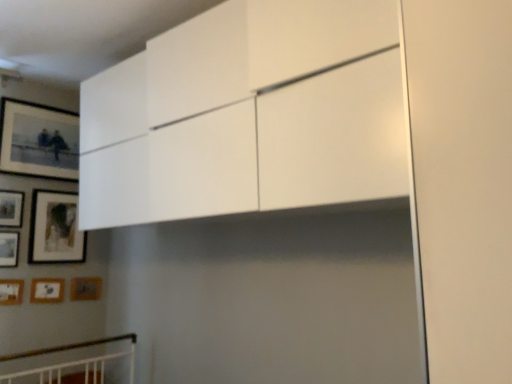
Question: Would you say matte black picture frame at upper left, positioned as the 7th picture frame in bottom-to-top order, contains wooden matte picture frame at lower left, placed as the 7th picture frame when sorted from top to bottom?

Choices:
 (A) no
 (B) yes

Answer: (A)

Question: Considering the relative positions of matte black picture frame at upper left, positioned as the 1th picture frame in top-to-bottom order, and wooden matte picture frame at lower left, placed as the 7th picture frame when sorted from top to bottom, in the image provided, is matte black picture frame at upper left, positioned as the 1th picture frame in top-to-bottom order, behind wooden matte picture frame at lower left, placed as the 7th picture frame when sorted from top to bottom,?

Choices:
 (A) yes
 (B) no

Answer: (B)

Question: From the image's perspective, would you say matte black picture frame at upper left, positioned as the 7th picture frame in bottom-to-top order, is positioned over wooden matte picture frame at lower left, marked as the 1th picture frame in a bottom-to-top arrangement?

Choices:
 (A) yes
 (B) no

Answer: (A)

Question: Does matte black picture frame at upper left, positioned as the 1th picture frame in top-to-bottom order, have a greater width compared to wooden matte picture frame at lower left, placed as the 7th picture frame when sorted from top to bottom?

Choices:
 (A) no
 (B) yes

Answer: (B)

Question: Would you consider matte black picture frame at upper left, positioned as the 1th picture frame in top-to-bottom order, to be distant from wooden matte picture frame at lower left, placed as the 7th picture frame when sorted from top to bottom?

Choices:
 (A) no
 (B) yes

Answer: (A)

Question: Considering the positions of point (15, 119) and point (64, 206), is point (15, 119) closer or farther from the camera than point (64, 206)?

Choices:
 (A) closer
 (B) farther

Answer: (A)

Question: Looking at the image, does matte black picture frame at upper left, positioned as the 7th picture frame in bottom-to-top order, seem bigger or smaller compared to matte black picture frame at upper left, acting as the 3th picture frame starting from the top?

Choices:
 (A) big
 (B) small

Answer: (B)

Question: Considering their positions, is matte black picture frame at upper left, positioned as the 1th picture frame in top-to-bottom order, located in front of or behind matte black picture frame at upper left, acting as the 3th picture frame starting from the top?

Choices:
 (A) front
 (B) behind

Answer: (A)

Question: From a real-world perspective, is matte black picture frame at upper left, positioned as the 1th picture frame in top-to-bottom order, above or below matte black picture frame at upper left, the 5th picture frame positioned from the bottom?

Choices:
 (A) above
 (B) below

Answer: (A)

Question: Is wooden matte picture frame at lower left, which appears as the 4th picture frame when viewed from the top, in front of or behind wooden matte picture frame at left, which appears as the 2th picture frame when viewed from the top, in the image?

Choices:
 (A) front
 (B) behind

Answer: (A)

Question: In terms of height, does wooden matte picture frame at lower left, which appears as the 4th picture frame when ordered from the bottom, look taller or shorter compared to wooden matte picture frame at left, which appears as the 2th picture frame when viewed from the top?

Choices:
 (A) short
 (B) tall

Answer: (A)

Question: Considering the positions of wooden matte picture frame at lower left, which appears as the 4th picture frame when ordered from the bottom, and wooden matte picture frame at left, which appears as the 2th picture frame when viewed from the top, in the image, is wooden matte picture frame at lower left, which appears as the 4th picture frame when ordered from the bottom, wider or thinner than wooden matte picture frame at left, which appears as the 2th picture frame when viewed from the top,?

Choices:
 (A) wide
 (B) thin

Answer: (B)

Question: Is wooden matte picture frame at lower left, which appears as the 4th picture frame when viewed from the top, bigger or smaller than wooden matte picture frame at left, the sixth picture frame ordered from the bottom?

Choices:
 (A) small
 (B) big

Answer: (A)

Question: Is matte black picture frame at upper left, positioned as the 7th picture frame in bottom-to-top order, bigger or smaller than wooden matte picture frame at lower left, which appears as the 4th picture frame when viewed from the top?

Choices:
 (A) big
 (B) small

Answer: (A)

Question: Considering the positions of matte black picture frame at upper left, positioned as the 1th picture frame in top-to-bottom order, and wooden matte picture frame at lower left, which appears as the 4th picture frame when ordered from the bottom, in the image, is matte black picture frame at upper left, positioned as the 1th picture frame in top-to-bottom order, taller or shorter than wooden matte picture frame at lower left, which appears as the 4th picture frame when ordered from the bottom,?

Choices:
 (A) short
 (B) tall

Answer: (B)